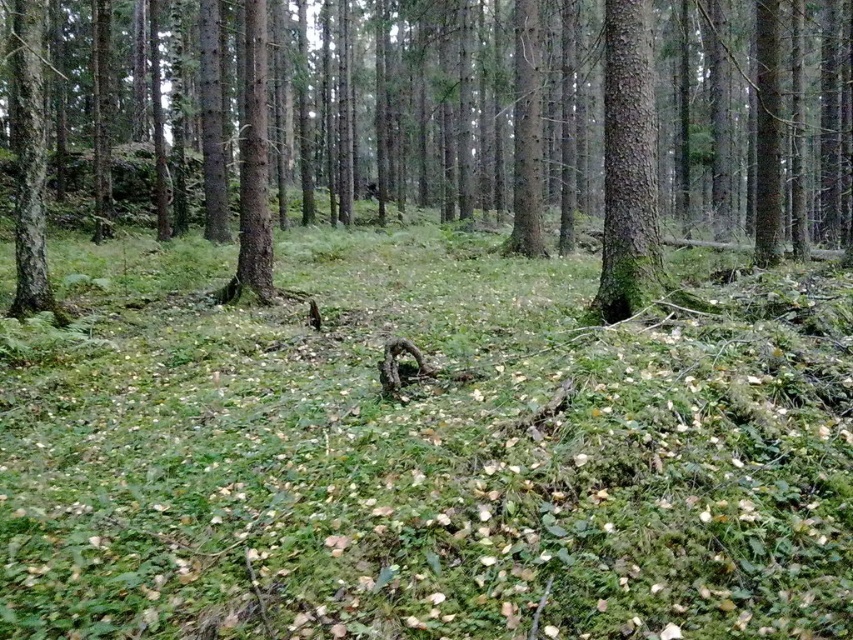
Question: Which point appears closest to the camera in this image?

Choices:
 (A) (621, 35)
 (B) (331, 628)

Answer: (B)

Question: Can you confirm if brown rough tree at center is smaller than green mossy tree trunk at center?

Choices:
 (A) no
 (B) yes

Answer: (A)

Question: Can you confirm if brown rough tree at center is positioned below green mossy tree trunk at center?

Choices:
 (A) yes
 (B) no

Answer: (B)

Question: Estimate the real-world distances between objects in this image. Which object is farther from the green rough bark tree at center?

Choices:
 (A) green mossy tree trunk at left
 (B) brown rough tree at center

Answer: (B)

Question: Which object is positioned closest to the green leafy grass at center?

Choices:
 (A) green mossy tree trunk at center
 (B) brown rough tree at center

Answer: (A)

Question: Is green leafy grass at center in front of green mossy tree trunk at center?

Choices:
 (A) no
 (B) yes

Answer: (B)